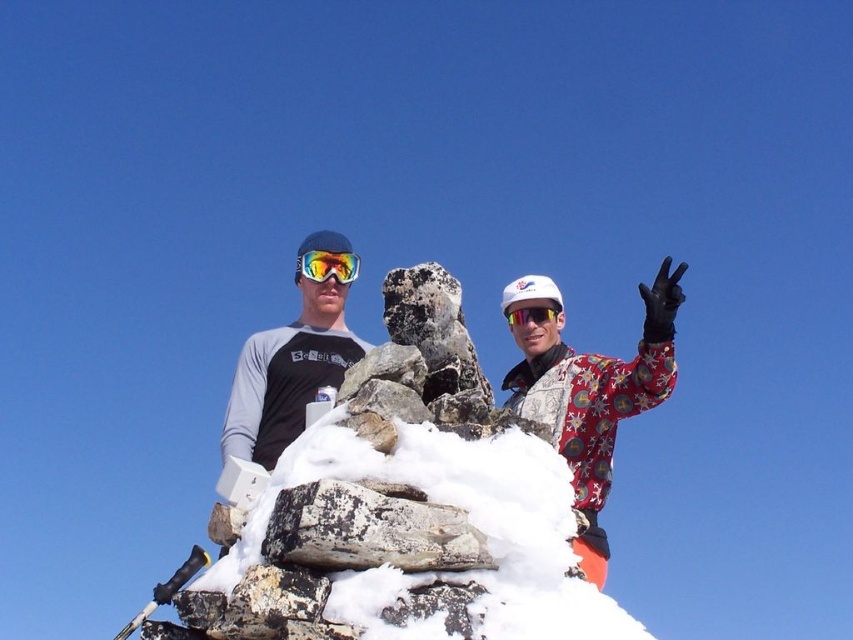
Which is below, matte black ski goggles at center or multicolored reflective goggles at center?

matte black ski goggles at center

Is matte black ski goggles at center shorter than multicolored reflective goggles at center?

In fact, matte black ski goggles at center may be taller than multicolored reflective goggles at center.

You are a GUI agent. You are given a task and a screenshot of the screen. Output one action in this format:
    pyautogui.click(x=<x>, y=<y>)
    Task: Click on the matte black ski goggles at center
    The width and height of the screenshot is (853, 640).
    Given the screenshot: What is the action you would take?
    pyautogui.click(x=293, y=355)

Where is `matte black ski goggles at center`? The width and height of the screenshot is (853, 640). matte black ski goggles at center is located at coordinates (293, 355).

This screenshot has height=640, width=853. What are the coordinates of `multicolored reflective goggles at center` in the screenshot? It's located at (328, 266).

Can you confirm if multicolored reflective goggles at center is taller than matte white goggles at center?

Correct, multicolored reflective goggles at center is much taller as matte white goggles at center.

Which is behind, point (323, 262) or point (546, 310)?

The point (323, 262) is more distant.

I want to click on multicolored reflective goggles at center, so click(328, 266).

What do you see at coordinates (368, 531) in the screenshot? I see `speckled rock at center` at bounding box center [368, 531].

Between point (422, 518) and point (511, 323), which one is positioned behind?

Point (511, 323)

Image resolution: width=853 pixels, height=640 pixels. I want to click on speckled rock at center, so click(x=368, y=531).